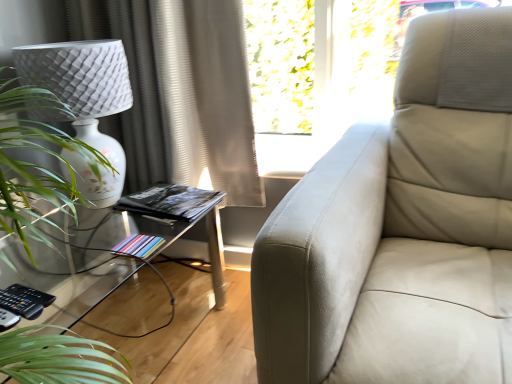
Question: From a real-world perspective, is pastel paper book at lower left, the 2th book viewed from the back, above or below black matte book at center, arranged as the 2th book when ordered from the bottom?

Choices:
 (A) below
 (B) above

Answer: (A)

Question: Considering the positions of pastel paper book at lower left, the first book from the bottom, and black matte book at center, positioned as the first book in top-to-bottom order, in the image, is pastel paper book at lower left, the first book from the bottom, taller or shorter than black matte book at center, positioned as the first book in top-to-bottom order,?

Choices:
 (A) short
 (B) tall

Answer: (A)

Question: Which of these objects is positioned farthest from the pastel paper book at lower left, which appears as the 1th book when viewed from the front?

Choices:
 (A) clear glass table at lower left
 (B) green leafy plant at left
 (C) beige textured curtain at upper left
 (D) black matte book at center, arranged as the 2th book when viewed from the front

Answer: (C)

Question: Considering the real-world distances, which object is farthest from the beige textured curtain at upper left?

Choices:
 (A) pastel paper book at lower left, the 2th book viewed from the back
 (B) black matte book at center, the first book when ordered from back to front
 (C) clear glass table at lower left
 (D) green leafy plant at left

Answer: (A)